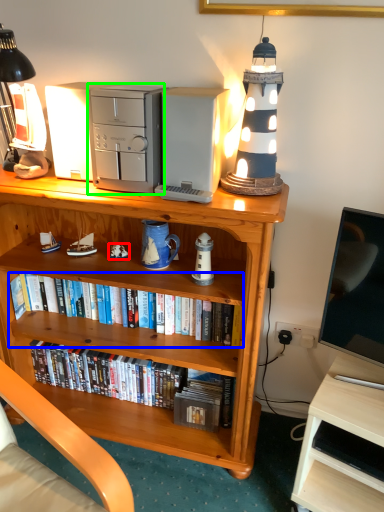
Question: Considering the real-world distances, which object is farthest from toy (highlighted by a red box)? book (highlighted by a blue box) or appliance (highlighted by a green box)?

Choices:
 (A) book
 (B) appliance

Answer: (B)